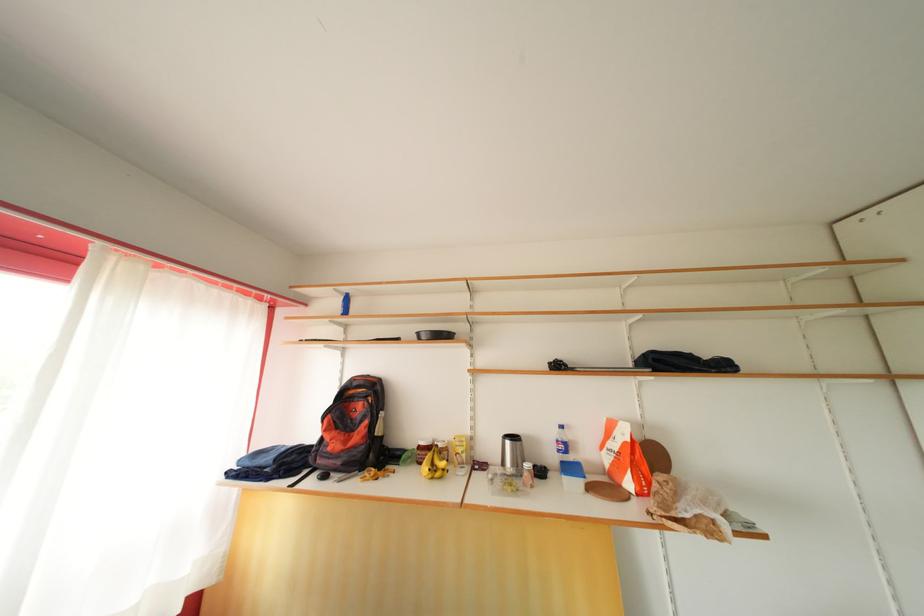
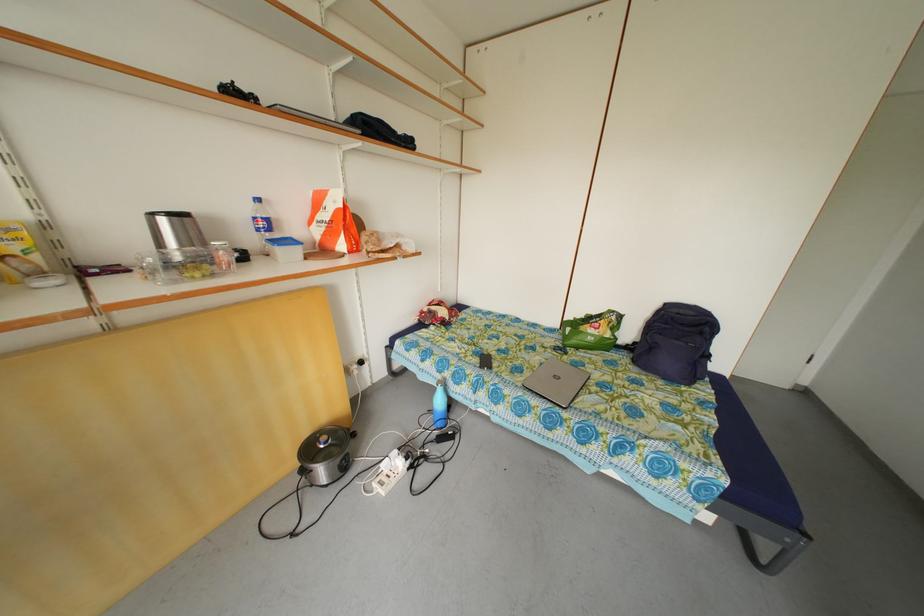
Locate, in the second image, the point that corresponds to [568,453] in the first image.

(270, 230)